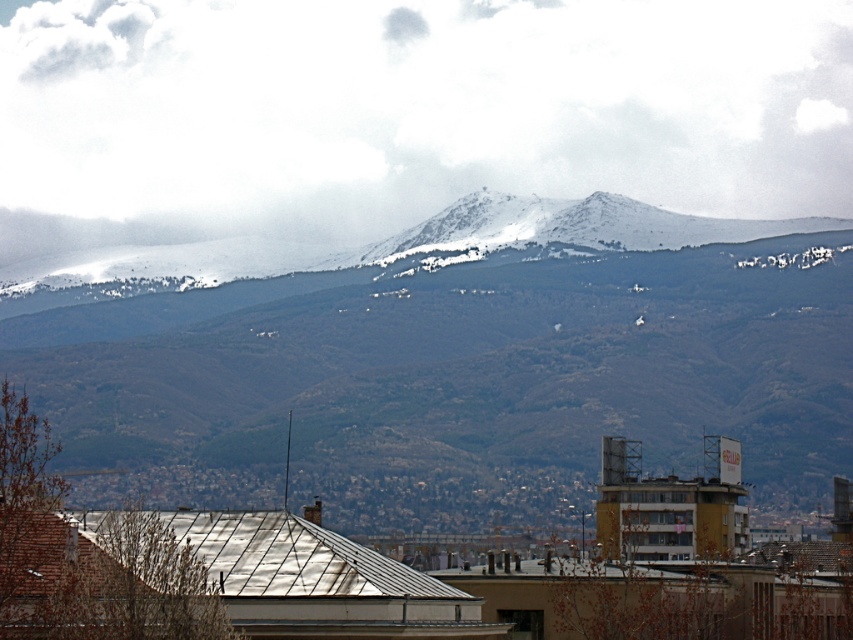
Does snowy mountain range at upper center appear over white fluffy cloud at upper center?

Actually, snowy mountain range at upper center is below white fluffy cloud at upper center.

Can you confirm if snowy mountain range at upper center is shorter than white fluffy cloud at upper center?

No, snowy mountain range at upper center is not shorter than white fluffy cloud at upper center.

The width and height of the screenshot is (853, 640). What are the coordinates of `snowy mountain range at upper center` in the screenshot? It's located at (465, 368).